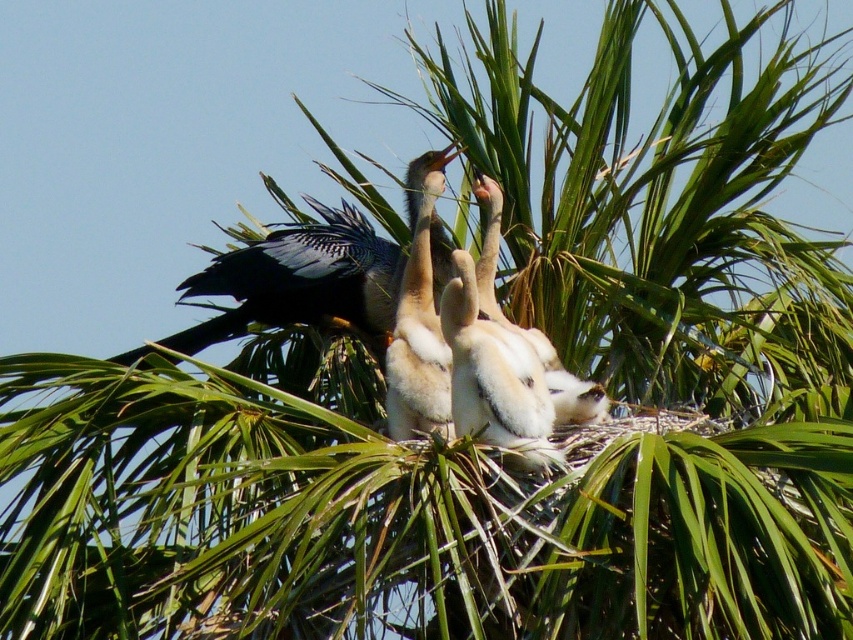
Question: Which object appears farthest from the camera in this image?

Choices:
 (A) white downy feathers at center
 (B) white fluffy nestling at center
 (C) white fluffy nestlings at center
 (D) blue-gray feathers at center

Answer: (D)

Question: Among these points, which one is nearest to the camera?

Choices:
 (A) (456, 336)
 (B) (231, 252)
 (C) (403, 436)

Answer: (A)

Question: Where is blue-gray feathers at center located in relation to white downy feathers at center in the image?

Choices:
 (A) right
 (B) left

Answer: (B)

Question: In this image, where is white fluffy nestling at center located relative to white downy feathers at center?

Choices:
 (A) left
 (B) right

Answer: (B)

Question: Is blue-gray feathers at center smaller than white downy feathers at center?

Choices:
 (A) yes
 (B) no

Answer: (A)

Question: Which object is positioned farthest from the blue-gray feathers at center?

Choices:
 (A) white fluffy nestling at center
 (B) white fluffy nestlings at center
 (C) white downy feathers at center

Answer: (A)